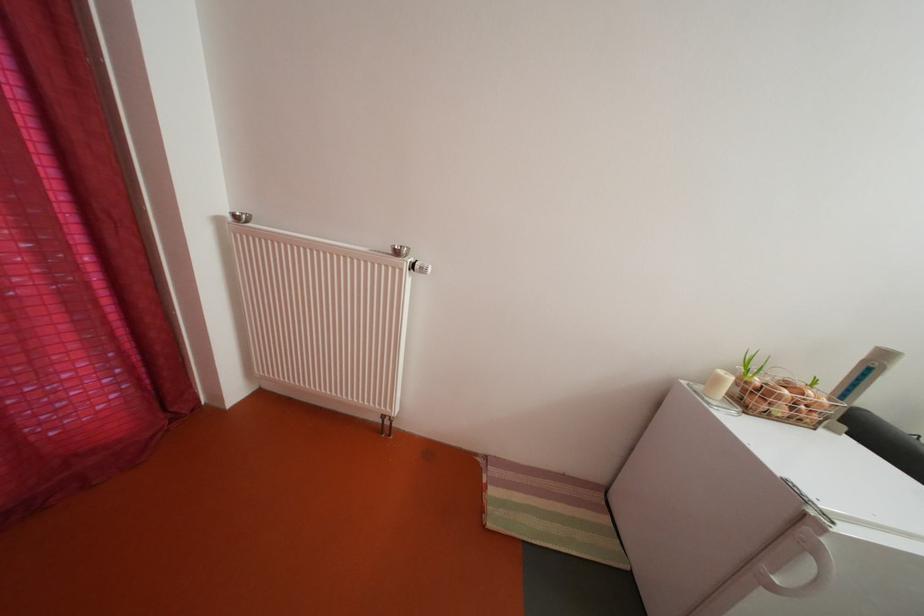
Where would you turn the radiator knob? Please return your answer as a coordinate pair (x, y).

(419, 267)